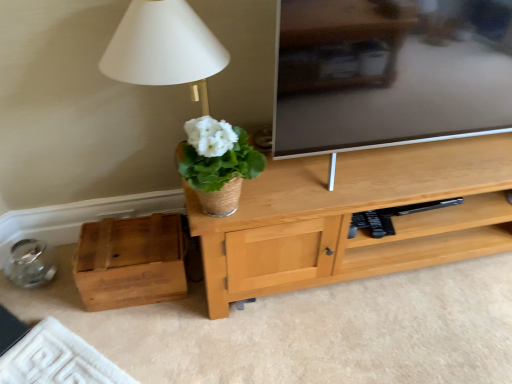
Question: From the image's perspective, relative to wooden box at lower left, is white woven pot at center above or below?

Choices:
 (A) above
 (B) below

Answer: (A)

Question: Is white woven pot at center wider or thinner than wooden box at lower left?

Choices:
 (A) thin
 (B) wide

Answer: (A)

Question: Relative to wooden box at lower left, is white woven pot at center in front or behind?

Choices:
 (A) behind
 (B) front

Answer: (B)

Question: In terms of height, does wooden box at lower left look taller or shorter compared to white woven pot at center?

Choices:
 (A) tall
 (B) short

Answer: (B)

Question: From the image's perspective, relative to white woven pot at center, is wooden box at lower left above or below?

Choices:
 (A) above
 (B) below

Answer: (B)

Question: From a real-world perspective, is wooden box at lower left positioned above or below white woven pot at center?

Choices:
 (A) below
 (B) above

Answer: (A)

Question: Is wooden box at lower left bigger or smaller than white woven pot at center?

Choices:
 (A) small
 (B) big

Answer: (B)